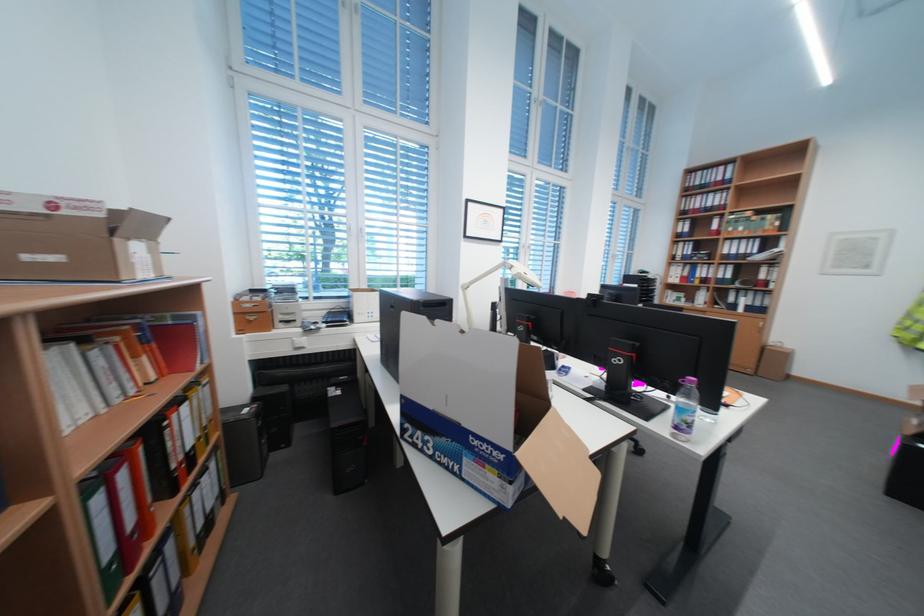
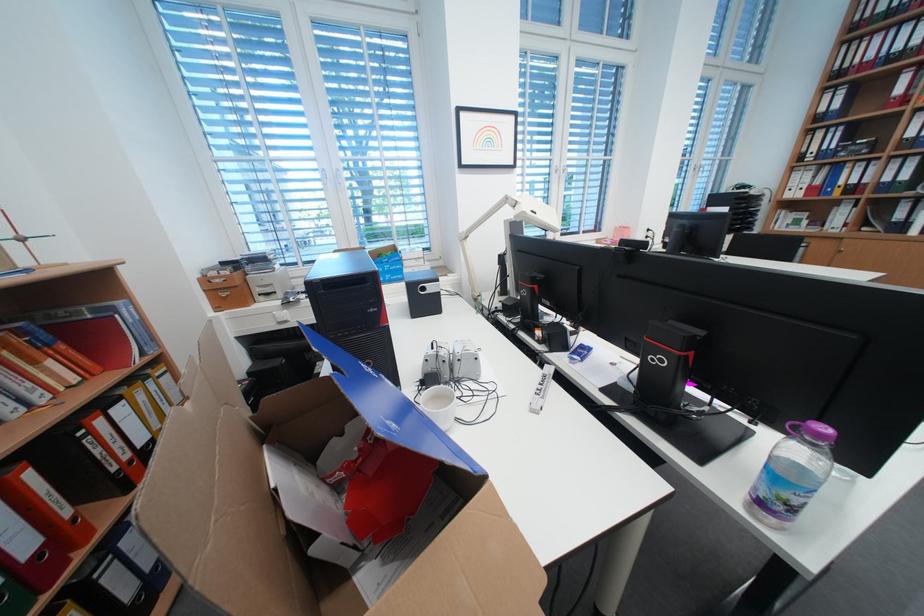
Question: How did the camera likely rotate?

Choices:
 (A) Left
 (B) Right
 (C) Up
 (D) Down

Answer: (D)